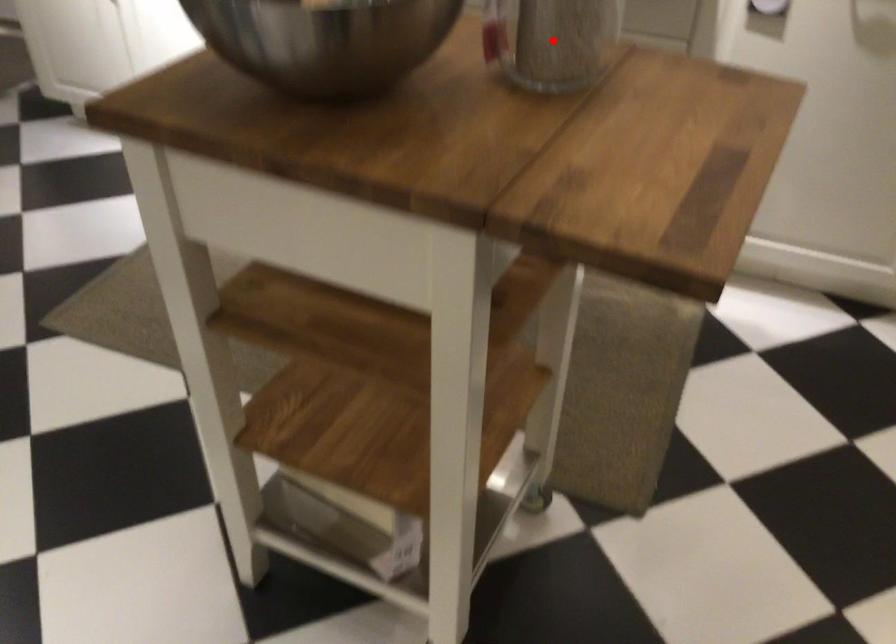
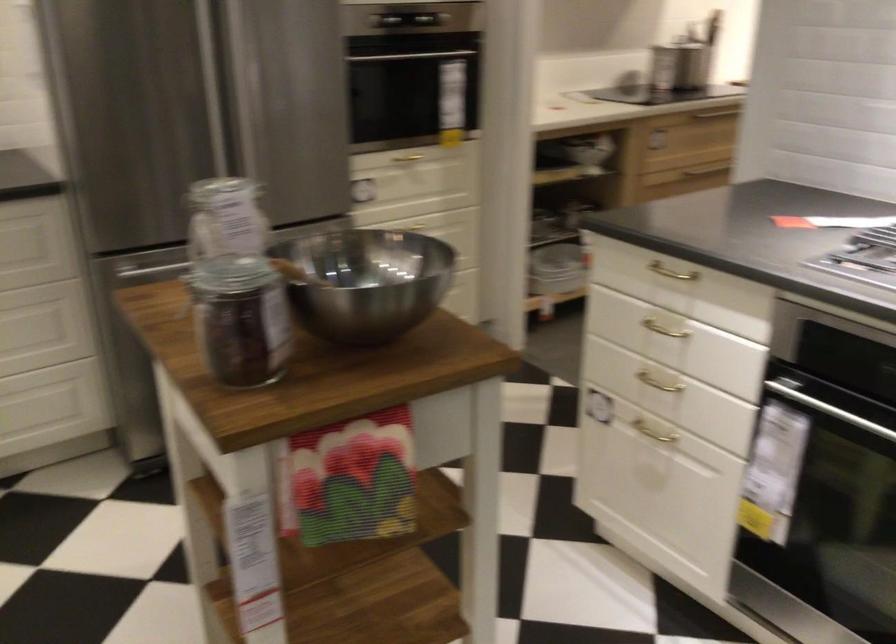
Question: I am providing you with two images of the same scene from different viewpoints. A red point is marked on the first image. At the location where the point appears in image 1, is it still visible in image 2?

Choices:
 (A) Yes
 (B) No

Answer: (B)